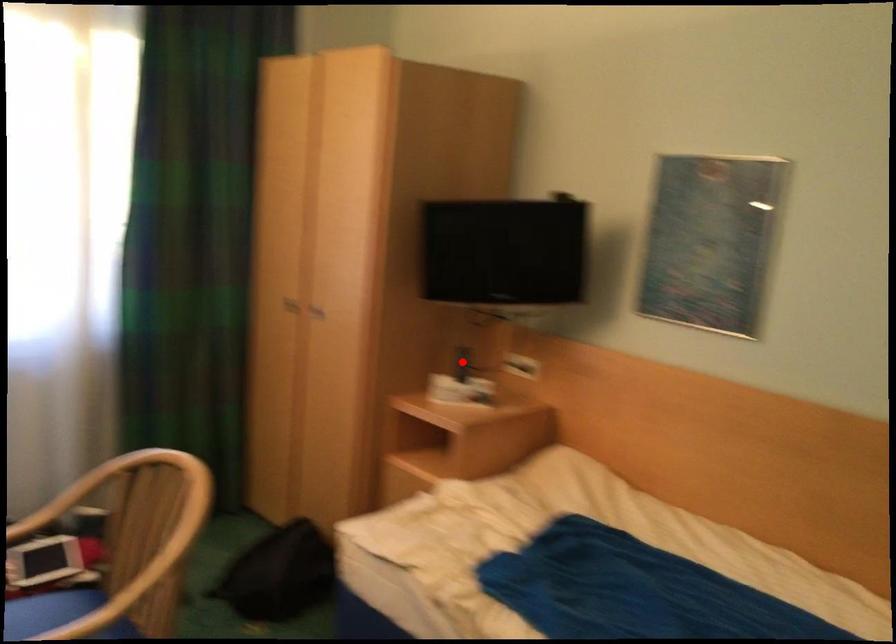
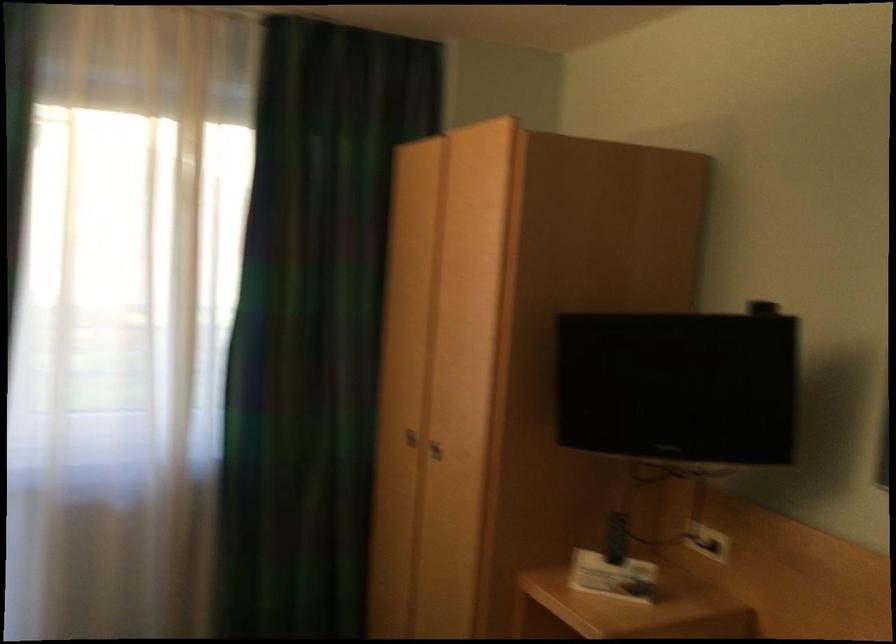
Question: I am providing you with two images of the same scene from different viewpoints. A red point is marked on the first image. At the location where the point appears in image 1, is it still visible in image 2?

Choices:
 (A) Yes
 (B) No

Answer: (A)